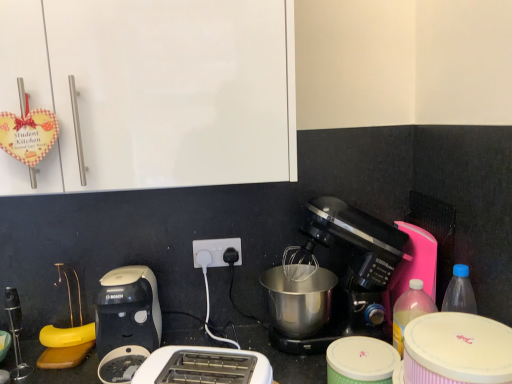
Question: Is the depth of black plastic coffee maker at center less than that of white plastic toaster at lower left, which is counted as the second toaster, starting from the right?

Choices:
 (A) yes
 (B) no

Answer: (B)

Question: Is black plastic coffee maker at center surrounding white plastic toaster at lower left, which is counted as the second toaster, starting from the right?

Choices:
 (A) yes
 (B) no

Answer: (B)

Question: From the image's perspective, does black plastic coffee maker at center appear lower than white plastic toaster at lower left, which ranks as the first toaster in left-to-right order?

Choices:
 (A) no
 (B) yes

Answer: (A)

Question: Can you confirm if black plastic coffee maker at center is thinner than white plastic toaster at lower left, which ranks as the first toaster in left-to-right order?

Choices:
 (A) yes
 (B) no

Answer: (A)

Question: From the image's perspective, is black plastic coffee maker at center above white plastic toaster at lower left, which is counted as the second toaster, starting from the right?

Choices:
 (A) yes
 (B) no

Answer: (A)

Question: Is white plastic power plugs and sockets at center taller or shorter than white plastic toaster at lower left, acting as the second toaster starting from the front?

Choices:
 (A) short
 (B) tall

Answer: (A)

Question: In terms of width, does white plastic power plugs and sockets at center look wider or thinner when compared to white plastic toaster at lower left, which is counted as the second toaster, starting from the right?

Choices:
 (A) wide
 (B) thin

Answer: (B)

Question: From a real-world perspective, is white plastic power plugs and sockets at center physically located above or below white plastic toaster at lower left, which is counted as the second toaster, starting from the right?

Choices:
 (A) below
 (B) above

Answer: (B)

Question: Considering the relative positions of white plastic power plugs and sockets at center and white plastic toaster at lower left, which ranks as the first toaster in left-to-right order, in the image provided, is white plastic power plugs and sockets at center to the left or to the right of white plastic toaster at lower left, which ranks as the first toaster in left-to-right order,?

Choices:
 (A) left
 (B) right

Answer: (B)

Question: Based on their positions, is white glossy cabinet at upper left located to the left or right of pink plastic bottle at right?

Choices:
 (A) left
 (B) right

Answer: (A)

Question: From a real-world perspective, relative to pink plastic bottle at right, is white glossy cabinet at upper left vertically above or below?

Choices:
 (A) below
 (B) above

Answer: (B)

Question: Would you say white glossy cabinet at upper left is inside or outside pink plastic bottle at right?

Choices:
 (A) inside
 (B) outside

Answer: (B)

Question: Considering their positions, is white glossy cabinet at upper left located in front of or behind pink plastic bottle at right?

Choices:
 (A) behind
 (B) front

Answer: (B)

Question: Is white glossy cabinet at upper left wider or thinner than black plastic coffee maker at center?

Choices:
 (A) thin
 (B) wide

Answer: (B)

Question: From the image's perspective, is white glossy cabinet at upper left positioned above or below black plastic coffee maker at center?

Choices:
 (A) above
 (B) below

Answer: (A)